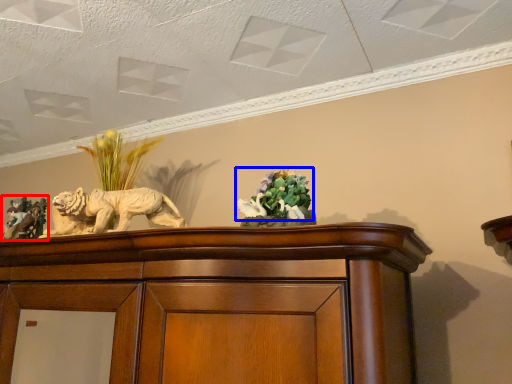
Question: Which object is closer to the camera taking this photo, sculpture (highlighted by a red box) or flower (highlighted by a blue box)?

Choices:
 (A) sculpture
 (B) flower

Answer: (B)